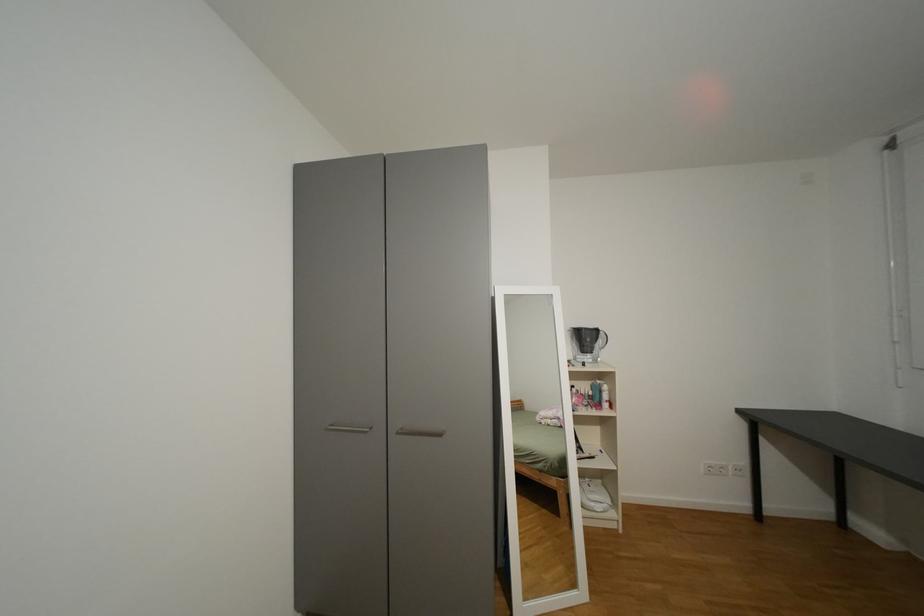
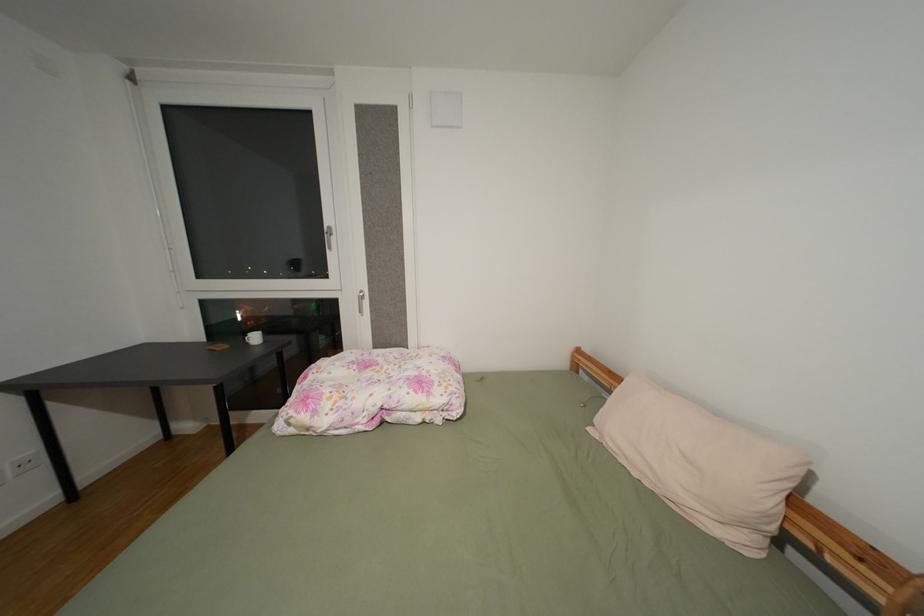
Question: Based on the continuous images, in which direction is the camera rotating? Reply with the corresponding letter.

Choices:
 (A) Left
 (B) Right
 (C) Up
 (D) Down

Answer: (B)